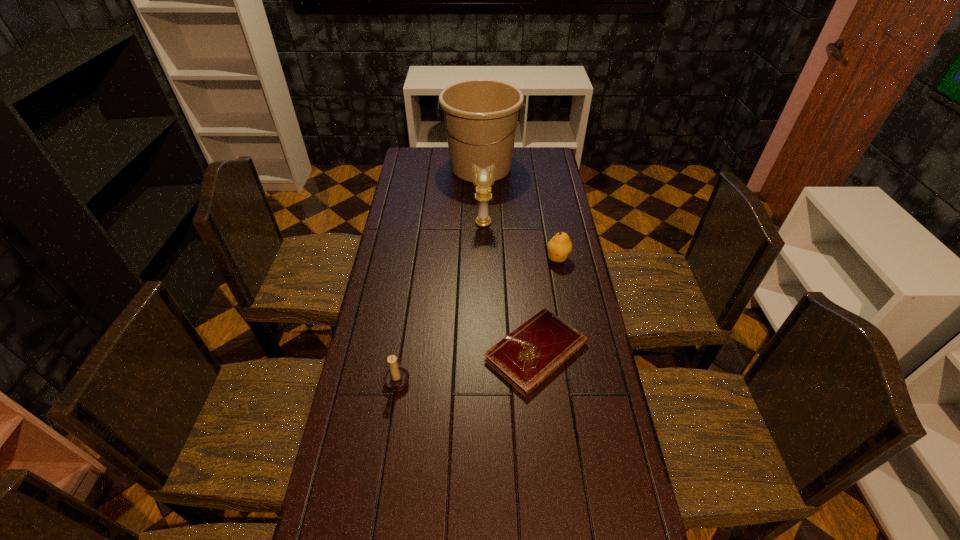
Identify the location of free space located on the front of the pear. click(x=574, y=349).

You are a GUI agent. You are given a task and a screenshot of the screen. Output one action in this format:
    pyautogui.click(x=<x>, y=<y>)
    Task: Click on the vacant space situated 0.350m on the left of the shortest object
    
    Given the screenshot: What is the action you would take?
    pyautogui.click(x=374, y=352)

Identify the location of object positioned at the far edge. The height and width of the screenshot is (540, 960). (481, 115).

Identify the location of object present at the left edge. (396, 378).

Locate an element on the screen. This screenshot has height=540, width=960. pear that is positioned at the right edge is located at coordinates (559, 247).

You are a GUI agent. You are given a task and a screenshot of the screen. Output one action in this format:
    pyautogui.click(x=<x>, y=<y>)
    Task: Click on the notebook present at the right edge
    This screenshot has height=540, width=960.
    Given the screenshot: What is the action you would take?
    pyautogui.click(x=528, y=355)

Locate an element on the screen. vacant area at the far edge is located at coordinates (519, 150).

At what (x,y) coordinates should I click in order to perform the action: click on free region at the left edge. Please return your answer as a coordinate pair (x, y). Image resolution: width=960 pixels, height=540 pixels. Looking at the image, I should click on (399, 279).

Find the location of a particular element. vacant region at the right edge of the desktop is located at coordinates (538, 262).

Identify the location of free spot at the far left corner of the desktop. (424, 165).